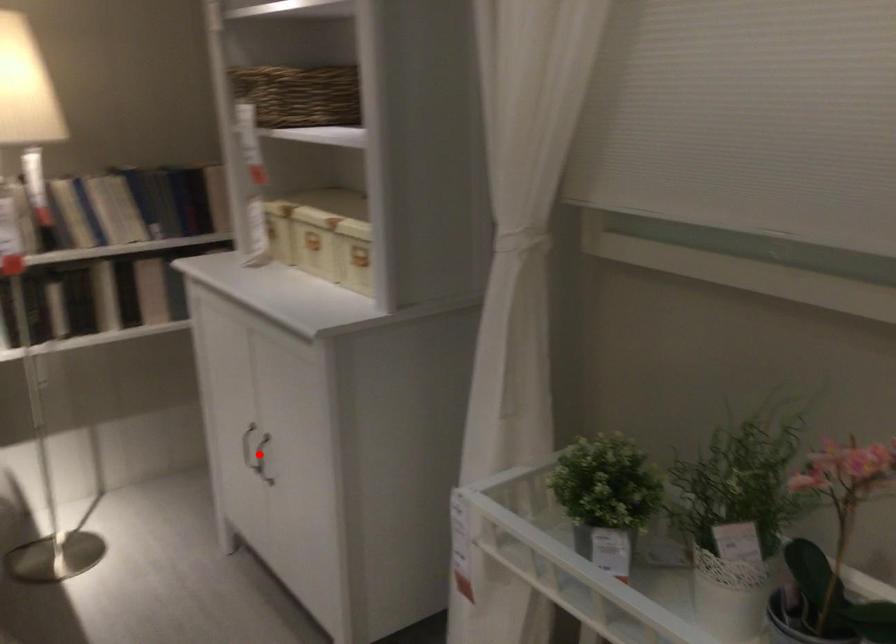
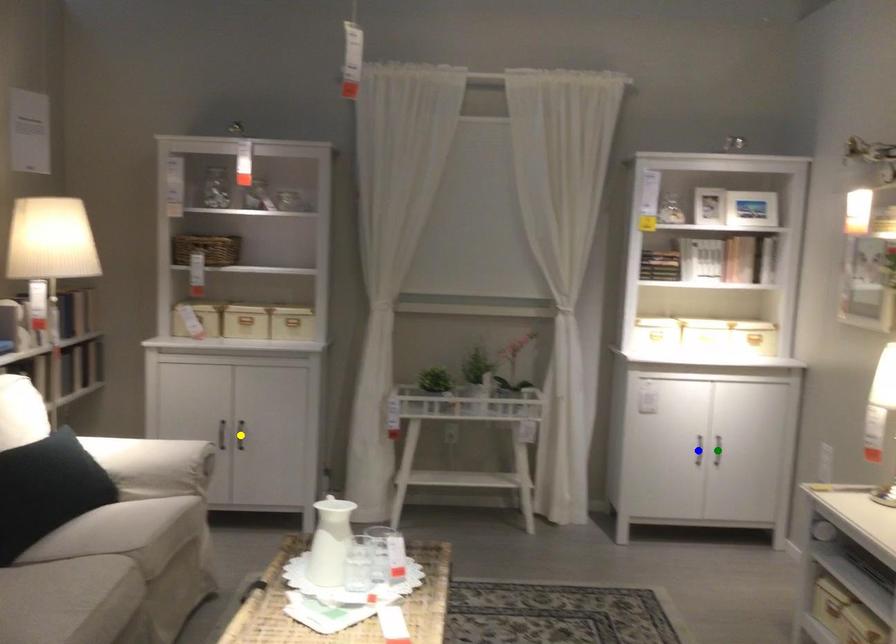
Question: I am providing you with two images of the same scene from different viewpoints. A red point is marked on the first image. You are given multiple points on the second image. Can you choose the point in image 2 that corresponds to the point in image 1?

Choices:
 (A) yellow point
 (B) green point
 (C) blue point

Answer: (A)